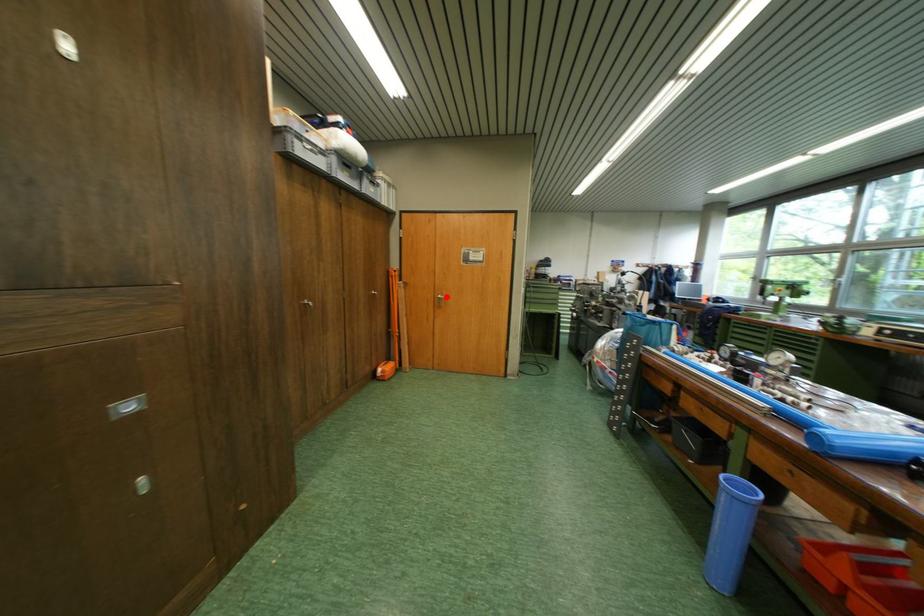
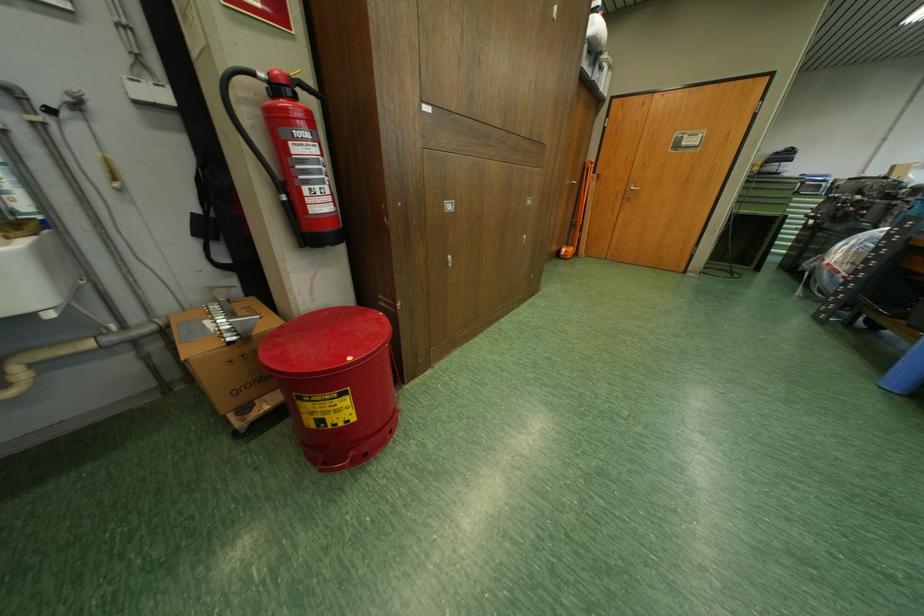
Question: I am providing you with two images of the same scene from different viewpoints. Given a red point in image1, look at the same physical point in image2. Is it:

Choices:
 (A) Closer to the viewpoint
 (B) Farther from the viewpoint

Answer: (A)